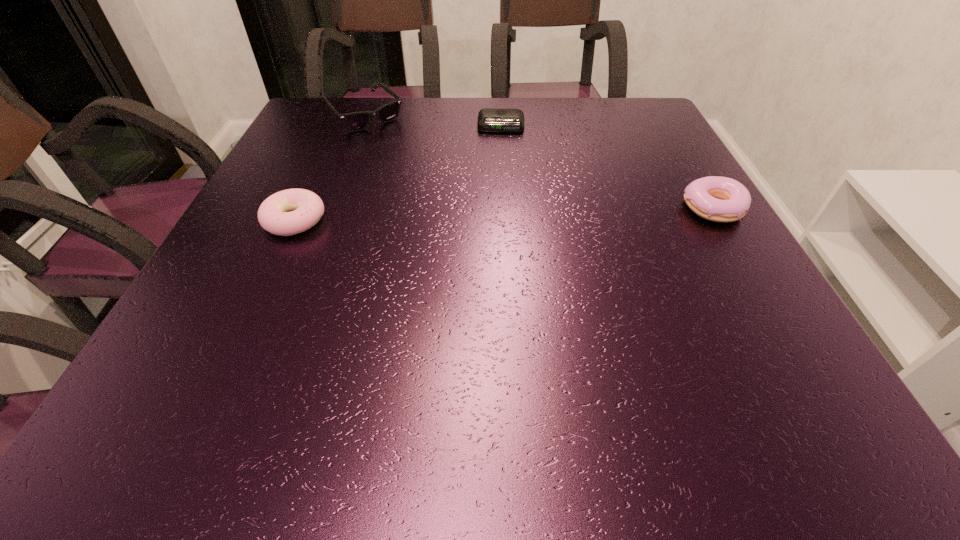
You are a GUI agent. You are given a task and a screenshot of the screen. Output one action in this format:
    pyautogui.click(x=<x>, y=<y>)
    Task: Click on the free space located 0.190m on the display of the alarm clock
    
    Given the screenshot: What is the action you would take?
    click(x=499, y=174)

Find the location of `vacant space located 0.210m on the front-facing side of the sunglasses`. vacant space located 0.210m on the front-facing side of the sunglasses is located at coordinates (420, 169).

The image size is (960, 540). What are the coordinates of `vacant area situated on the front-facing side of the sunglasses` in the screenshot? It's located at (438, 185).

The height and width of the screenshot is (540, 960). I want to click on free location located on the front-facing side of the sunglasses, so pos(434,181).

Where is `alarm clock that is at the far edge`? alarm clock that is at the far edge is located at coordinates (489, 119).

Where is `sunglasses that is at the far edge`? The width and height of the screenshot is (960, 540). sunglasses that is at the far edge is located at coordinates (356, 121).

The image size is (960, 540). I want to click on doughnut that is at the left edge, so [292, 211].

Where is `sunglasses located in the left edge section of the desktop`? The height and width of the screenshot is (540, 960). sunglasses located in the left edge section of the desktop is located at coordinates (356, 121).

Find the location of `object situated at the right edge`. object situated at the right edge is located at coordinates (720, 199).

Identify the location of object at the far left corner. (356, 121).